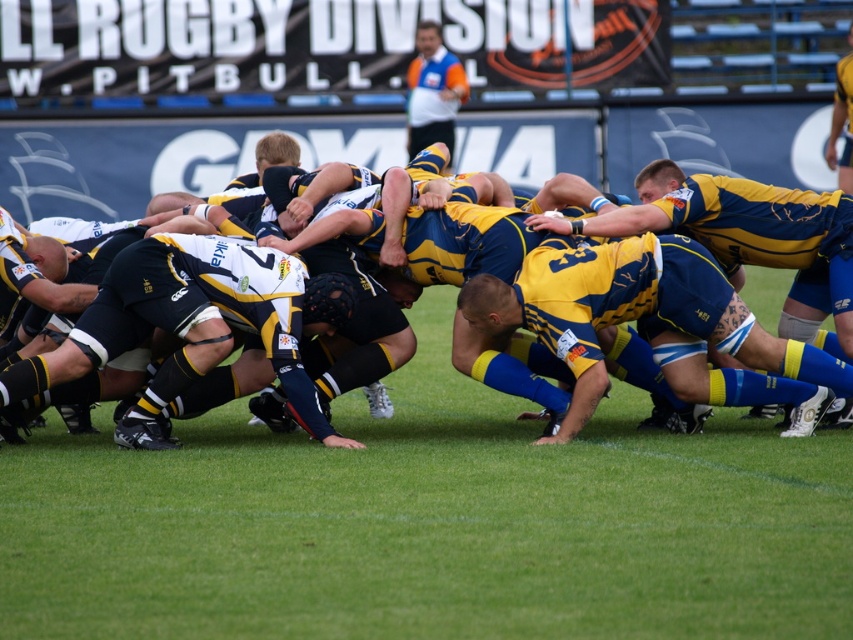
Question: Does blue jersey at center appear under orange shirt at upper center?

Choices:
 (A) yes
 (B) no

Answer: (A)

Question: Which point is closer to the camera taking this photo?

Choices:
 (A) (200, 243)
 (B) (413, 232)
 (C) (430, 72)

Answer: (A)

Question: Which is farther from the orange shirt at upper center?

Choices:
 (A) blue jersey at center
 (B) dark blue jersey at center

Answer: (B)

Question: Does blue jersey at center have a greater width compared to orange shirt at upper center?

Choices:
 (A) no
 (B) yes

Answer: (B)

Question: Can you confirm if blue jersey at center is thinner than orange shirt at upper center?

Choices:
 (A) yes
 (B) no

Answer: (B)

Question: Estimate the real-world distances between objects in this image. Which object is closer to the blue jersey at center?

Choices:
 (A) dark blue jersey at center
 (B) yellow and blue rugby jersey at center
 (C) orange shirt at upper center

Answer: (B)